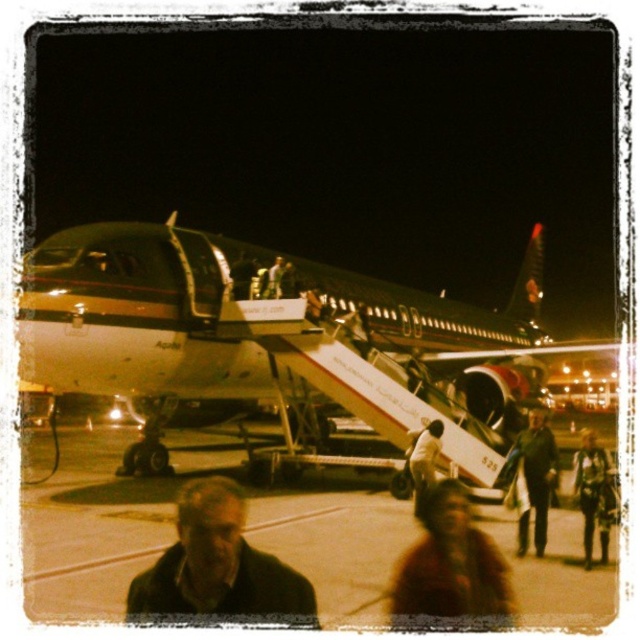
You are standing at the entrance of the airport terminal and see the white metallic airplane at center. If you walk straight towards the airplane, will you reach it before reaching the staircase?

The white metallic airplane at center is located at point (x=289, y=337). Since the staircase is part of the airplane, walking straight towards the airplane would mean you reach the staircase first before the airplane itself.